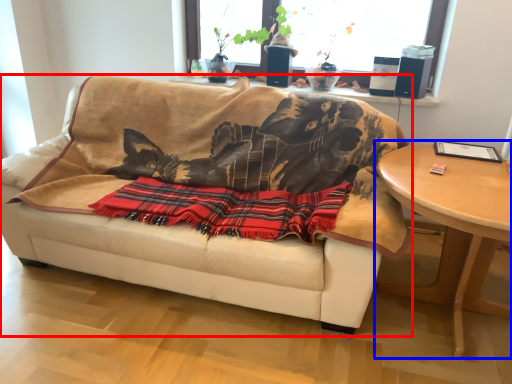
Question: Which point is further to the camera, studio couch (highlighted by a red box) or table (highlighted by a blue box)?

Choices:
 (A) studio couch
 (B) table

Answer: (A)